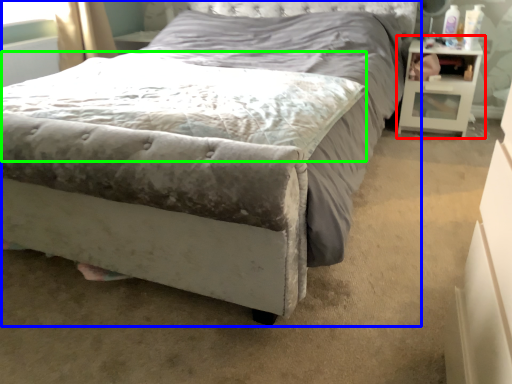
Question: Which object is the closest to the nightstand (highlighted by a red box)? Choose among these: bed (highlighted by a blue box) or mattress (highlighted by a green box).

Choices:
 (A) bed
 (B) mattress

Answer: (A)